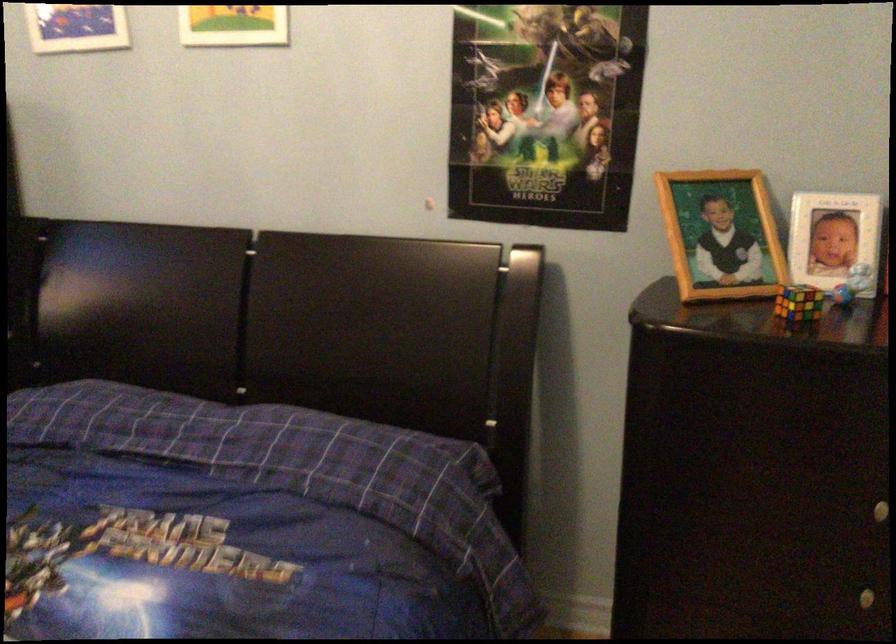
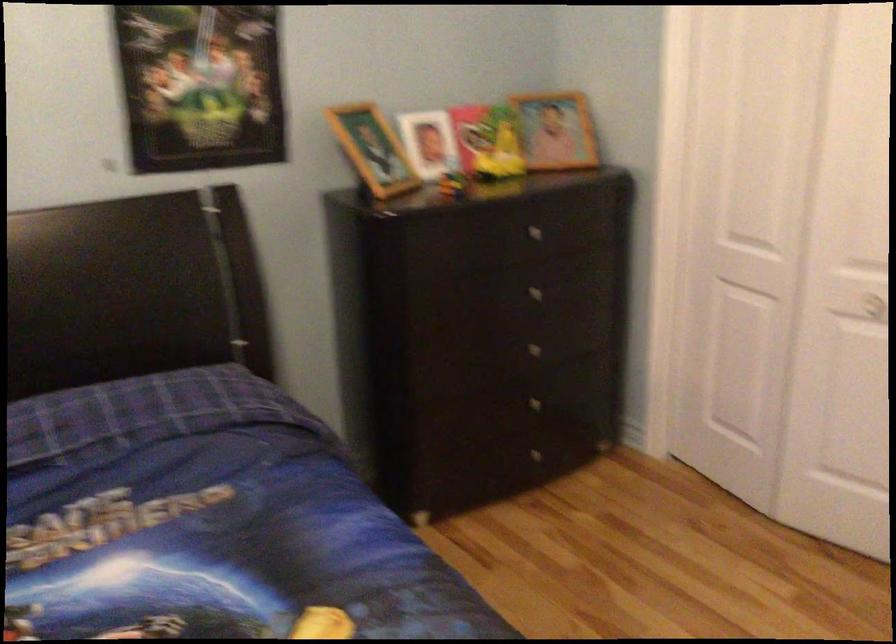
Question: Based on the continuous images, in which direction is the camera rotating? Reply with the corresponding letter.

Choices:
 (A) Left
 (B) Right
 (C) Up
 (D) Down

Answer: (B)